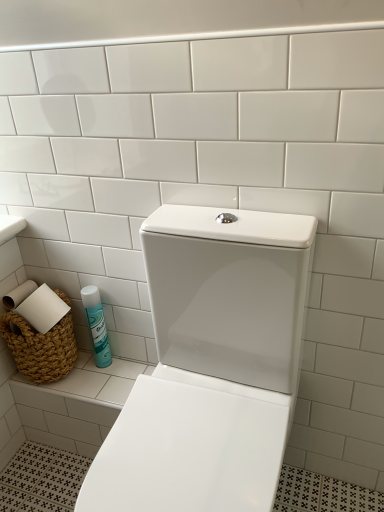
Image resolution: width=384 pixels, height=512 pixels. Find the location of `unoccupied region to the right of braided wicker basket at lower left`. unoccupied region to the right of braided wicker basket at lower left is located at coordinates (109, 379).